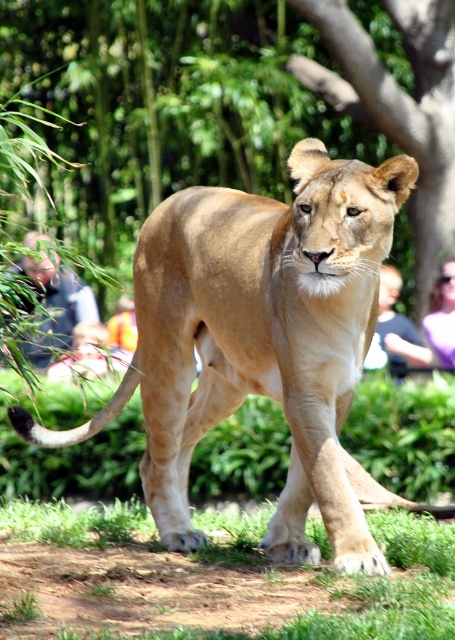
Which is above, green leafy tree at center or smooth skin person at right?

green leafy tree at center is higher up.

Does green leafy tree at center have a greater width compared to smooth skin person at right?

Yes, green leafy tree at center is wider than smooth skin person at right.

Who is more distant from viewer, (9, 77) or (380, 353)?

The point (9, 77) is behind.

What are the coordinates of `green leafy tree at center` in the screenshot? It's located at (232, 104).

Is green leafy tree at center smaller than blurred sunglasses at upper center?

No.

Who is more forward, [95,179] or [449,330]?

Point [449,330] is in front.

At what (x,y) coordinates should I click in order to perform the action: click on green leafy tree at center. Please return your answer as a coordinate pair (x, y). Looking at the image, I should click on (232, 104).

Locate an element on the screen. This screenshot has width=455, height=640. green leafy tree at center is located at coordinates (232, 104).

Does green leafy tree at center have a lesser width compared to brown textured tree at center?

Incorrect, green leafy tree at center's width is not less than brown textured tree at center's.

Can you confirm if green leafy tree at center is positioned below brown textured tree at center?

Incorrect, green leafy tree at center is not positioned below brown textured tree at center.

Identify the location of green leafy tree at center. The image size is (455, 640). (232, 104).